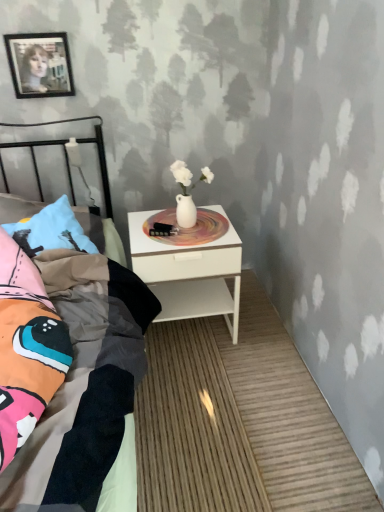
I want to click on white glossy nightstand at center, so click(x=189, y=274).

In order to face multicolored fabric bed at left, should I rotate leftwards or rightwards?

Turn left approximately 17.594 degrees to face it.

In order to click on white glossy nightstand at center in this screenshot , I will do `click(189, 274)`.

Can you confirm if white glossy nightstand at center is shorter than black glossy picture frame at upper left?

No.

Between point (169, 252) and point (59, 57), which one is positioned behind?

The point (59, 57) is farther from the camera.

Is white glossy nightstand at center positioned with its back to black glossy picture frame at upper left?

No, white glossy nightstand at center is not facing away from black glossy picture frame at upper left.

Which object is positioned more to the right, white glossy nightstand at center or black glossy picture frame at upper left?

Positioned to the right is white glossy nightstand at center.

How many degrees apart are the facing directions of black glossy picture frame at upper left and multicolored fabric bed at left?

The angle between the facing direction of black glossy picture frame at upper left and the facing direction of multicolored fabric bed at left is 0.305 degrees.

Which object is more forward, black glossy picture frame at upper left or multicolored fabric bed at left?

multicolored fabric bed at left.

Is black glossy picture frame at upper left not close to multicolored fabric bed at left?

Actually, black glossy picture frame at upper left and multicolored fabric bed at left are a little close together.

Is point (56, 45) positioned before point (82, 298)?

No, (56, 45) is behind (82, 298).

Does black glossy picture frame at upper left appear on the right side of white glossy nightstand at center?

No, black glossy picture frame at upper left is not to the right of white glossy nightstand at center.

Looking at their sizes, would you say black glossy picture frame at upper left is wider or thinner than white glossy nightstand at center?

black glossy picture frame at upper left is thinner than white glossy nightstand at center.

Does black glossy picture frame at upper left touch white glossy nightstand at center?

black glossy picture frame at upper left and white glossy nightstand at center are clearly separated.

Measure the distance between black glossy picture frame at upper left and white glossy nightstand at center.

The distance of black glossy picture frame at upper left from white glossy nightstand at center is 34.90 inches.

Does multicolored fabric bed at left have a lesser height compared to white glossy nightstand at center?

Incorrect, the height of multicolored fabric bed at left does not fall short of that of white glossy nightstand at center.

Is multicolored fabric bed at left located outside white glossy nightstand at center?

Yes, multicolored fabric bed at left is not within white glossy nightstand at center.

Which of these two, multicolored fabric bed at left or white glossy nightstand at center, is bigger?

multicolored fabric bed at left is bigger.

Is white glossy nightstand at center in front of or behind multicolored fabric bed at left in the image?

In the image, white glossy nightstand at center appears behind multicolored fabric bed at left.

What's the angular difference between white glossy nightstand at center and multicolored fabric bed at left's facing directions?

The angular difference between white glossy nightstand at center and multicolored fabric bed at left is 0.549 degrees.

Identify the location of bed above the white glossy nightstand at center (from a real-world perspective). This screenshot has width=384, height=512. (87, 390).

From a real-world perspective, is white glossy nightstand at center above or below multicolored fabric bed at left?

white glossy nightstand at center is situated lower than multicolored fabric bed at left in the real world.

Who is shorter, multicolored fabric bed at left or black glossy picture frame at upper left?

Standing shorter between the two is black glossy picture frame at upper left.

From a real-world perspective, which object rests below the other?

multicolored fabric bed at left, from a real-world perspective.

Which is further, [107,315] or [71,83]?

The point [71,83] is farther.

Is multicolored fabric bed at left touching black glossy picture frame at upper left?

No.

Identify the location of nightstand located underneath the black glossy picture frame at upper left (from a real-world perspective). (189, 274).

The width and height of the screenshot is (384, 512). In order to click on picture frame that appears behind the multicolored fabric bed at left in this screenshot , I will do `click(40, 64)`.

Based on their spatial positions, is black glossy picture frame at upper left or white glossy nightstand at center closer to multicolored fabric bed at left?

The object closer to multicolored fabric bed at left is white glossy nightstand at center.

Considering their positions, is white glossy nightstand at center positioned further to multicolored fabric bed at left than black glossy picture frame at upper left?

black glossy picture frame at upper left.

Which object lies nearer to the anchor point black glossy picture frame at upper left, multicolored fabric bed at left or white glossy nightstand at center?

white glossy nightstand at center is positioned closer to the anchor black glossy picture frame at upper left.

When comparing their distances from white glossy nightstand at center, does multicolored fabric bed at left or black glossy picture frame at upper left seem closer?

Among the two, multicolored fabric bed at left is located nearer to white glossy nightstand at center.

Looking at the image, which one is located closer to white glossy nightstand at center, black glossy picture frame at upper left or multicolored fabric bed at left?

Based on the image, multicolored fabric bed at left appears to be nearer to white glossy nightstand at center.

Based on their spatial positions, is white glossy nightstand at center or multicolored fabric bed at left further from black glossy picture frame at upper left?

multicolored fabric bed at left.

Find the location of a particular element. The width and height of the screenshot is (384, 512). nightstand between multicolored fabric bed at left and black glossy picture frame at upper left along the z-axis is located at coordinates (189, 274).